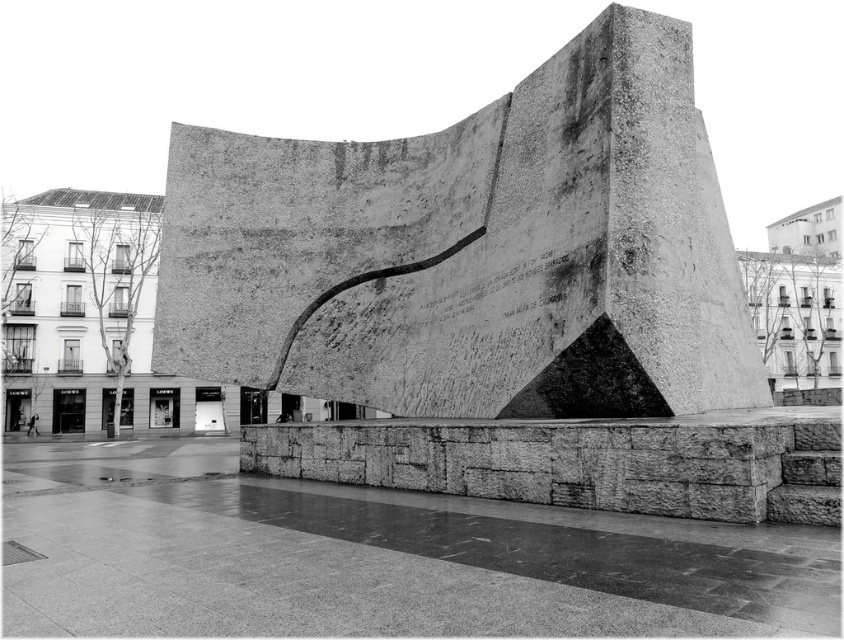
You are a construction worker needing to place a 20 feet long metal beam between the smooth concrete wall at lower center and the rough stone ledge at center. Can the beam fit between them without bending?

The distance between the smooth concrete wall at lower center and the rough stone ledge at center is 25.80 feet. Since the beam is 20 feet long, it can fit between them without bending as there is enough space.

You are standing in the plaza and want to take a photo of the large abstract concrete sculpture. To ensure the smooth concrete wall at lower center is not in the background, where should you position yourself relative to the sculpture?

To avoid the smooth concrete wall at lower center in the background, position yourself to the left or right side of the sculpture, as the wall is located at the lower center point coordinates, which is directly behind the sculpture from those angles.